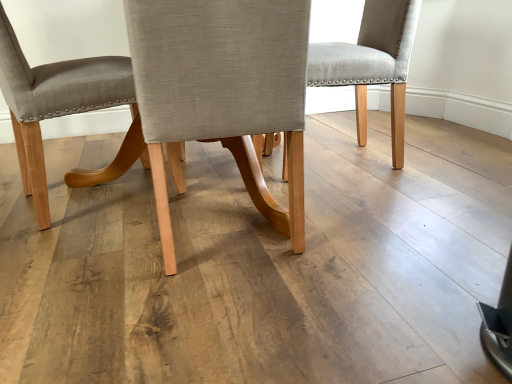
Question: Considering the relative sizes of light gray fabric chair at center, which is counted as the second chair, starting from the left, and light gray fabric chair at center, the 1th chair when ordered from right to left, in the image provided, is light gray fabric chair at center, which is counted as the second chair, starting from the left, thinner than light gray fabric chair at center, the 1th chair when ordered from right to left,?

Choices:
 (A) yes
 (B) no

Answer: (B)

Question: From the image's perspective, would you say light gray fabric chair at center, marked as the 2th chair in a right-to-left arrangement, is shown under light gray fabric chair at center, which is the third chair in left-to-right order?

Choices:
 (A) no
 (B) yes

Answer: (B)

Question: Is light gray fabric chair at center, which is the third chair in left-to-right order, at the back of light gray fabric chair at center, marked as the 2th chair in a right-to-left arrangement?

Choices:
 (A) no
 (B) yes

Answer: (A)

Question: Can you confirm if light gray fabric chair at center, marked as the 2th chair in a right-to-left arrangement, is wider than light gray fabric chair at center, which is the third chair in left-to-right order?

Choices:
 (A) yes
 (B) no

Answer: (A)

Question: Considering the relative sizes of light gray fabric chair at center, marked as the 2th chair in a right-to-left arrangement, and light gray fabric chair at center, the 1th chair when ordered from right to left, in the image provided, is light gray fabric chair at center, marked as the 2th chair in a right-to-left arrangement, shorter than light gray fabric chair at center, the 1th chair when ordered from right to left,?

Choices:
 (A) yes
 (B) no

Answer: (B)

Question: Considering the relative positions of light gray fabric chair at center, marked as the 2th chair in a right-to-left arrangement, and light gray fabric chair at center, which is the third chair in left-to-right order, in the image provided, is light gray fabric chair at center, marked as the 2th chair in a right-to-left arrangement, behind light gray fabric chair at center, which is the third chair in left-to-right order,?

Choices:
 (A) no
 (B) yes

Answer: (A)

Question: Can you confirm if matte gray fabric chair at center, placed as the third chair when sorted from right to left, is positioned to the left of light gray fabric chair at center, marked as the 2th chair in a right-to-left arrangement?

Choices:
 (A) no
 (B) yes

Answer: (B)

Question: Would you say light gray fabric chair at center, marked as the 2th chair in a right-to-left arrangement, is part of matte gray fabric chair at center, which appears as the first chair when viewed from the left,'s contents?

Choices:
 (A) no
 (B) yes

Answer: (A)

Question: Considering the relative sizes of matte gray fabric chair at center, placed as the third chair when sorted from right to left, and light gray fabric chair at center, which is counted as the second chair, starting from the left, in the image provided, is matte gray fabric chair at center, placed as the third chair when sorted from right to left, taller than light gray fabric chair at center, which is counted as the second chair, starting from the left,?

Choices:
 (A) no
 (B) yes

Answer: (B)

Question: Is matte gray fabric chair at center, which appears as the first chair when viewed from the left, smaller than light gray fabric chair at center, which is counted as the second chair, starting from the left?

Choices:
 (A) yes
 (B) no

Answer: (B)

Question: From a real-world perspective, does matte gray fabric chair at center, placed as the third chair when sorted from right to left, stand above light gray fabric chair at center, marked as the 2th chair in a right-to-left arrangement?

Choices:
 (A) yes
 (B) no

Answer: (A)

Question: Does matte gray fabric chair at center, placed as the third chair when sorted from right to left, lie in front of light gray fabric chair at center, which is counted as the second chair, starting from the left?

Choices:
 (A) yes
 (B) no

Answer: (B)

Question: Considering the relative positions of light gray fabric chair at center, the 1th chair when ordered from right to left, and light gray fabric chair at center, marked as the 2th chair in a right-to-left arrangement, in the image provided, is light gray fabric chair at center, the 1th chair when ordered from right to left, in front of light gray fabric chair at center, marked as the 2th chair in a right-to-left arrangement,?

Choices:
 (A) no
 (B) yes

Answer: (A)